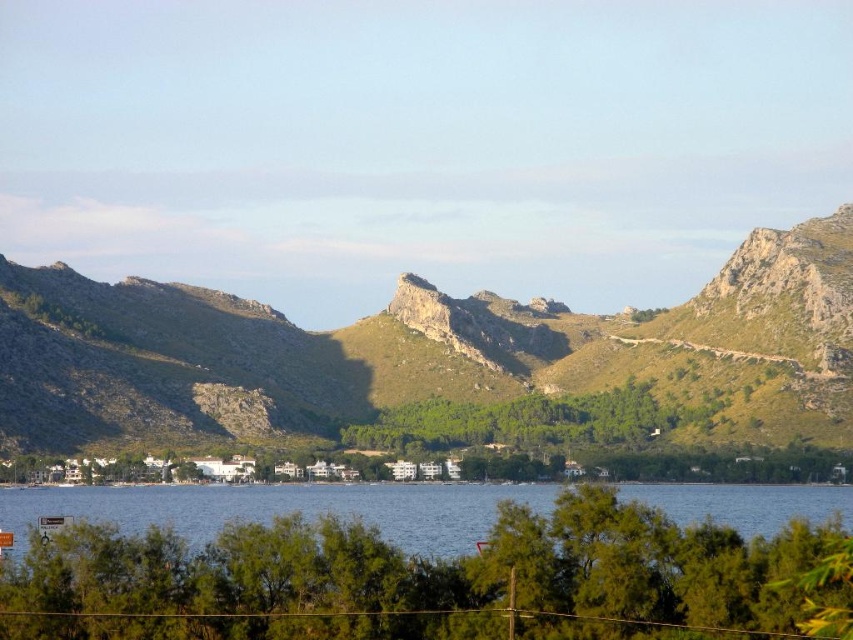
You are planning to build a hiking trail between the green grassy mountain at center and the blue water at center. What is the minimum distance you need to cover to connect them?

The minimum distance between the green grassy mountain at center and the blue water at center is 49.73 meters, so you need to cover at least 49.73 meters to connect them.

You are a hiker standing on the green grassy mountain at center and want to reach the blue water at center. Which direction should you move to get there?

Since the blue water at center is behind the green grassy mountain at center, you should move forward to reach the blue water at center.

You are standing at the edge of the blue water at center and want to reach the green grassy mountain at center. Which direction should you walk to get there?

You should walk to your left because the green grassy mountain at center is located to the left of the blue water at center.